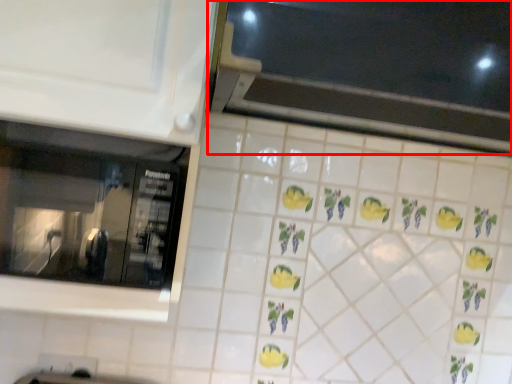
Question: From the image's perspective, what is the correct spatial positioning of window (annotated by the red box) in reference to window?

Choices:
 (A) below
 (B) above

Answer: (B)